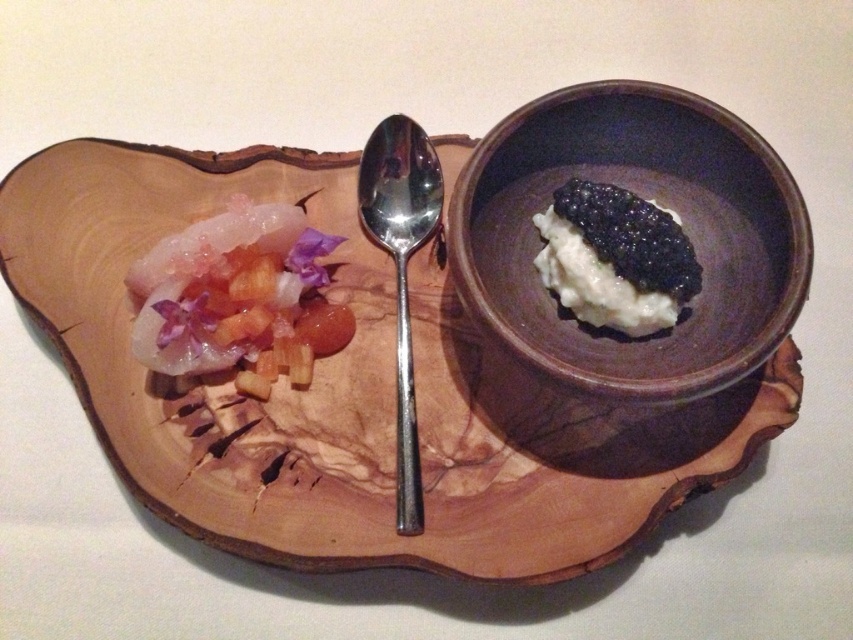
Does wooden platter at center lie in front of translucent gelatinous at left?

Yes.

Image resolution: width=853 pixels, height=640 pixels. Identify the location of wooden platter at center. (331, 388).

Does black glossy caviar at center have a greater height compared to polished silver spoon at center?

In fact, black glossy caviar at center may be shorter than polished silver spoon at center.

Does point (589, 320) come farther from viewer compared to point (399, 193)?

No, it is not.

Does point (613, 278) come behind point (393, 122)?

No.

At what (x,y) coordinates should I click in order to perform the action: click on black glossy caviar at center. Please return your answer as a coordinate pair (x, y). Looking at the image, I should click on (614, 257).

Who is positioned more to the right, wooden platter at center or brown matte bowl at center?

brown matte bowl at center is more to the right.

Is wooden platter at center smaller than brown matte bowl at center?

No, wooden platter at center is not smaller than brown matte bowl at center.

The width and height of the screenshot is (853, 640). What do you see at coordinates (331, 388) in the screenshot?
I see `wooden platter at center` at bounding box center [331, 388].

Identify the location of wooden platter at center. (331, 388).